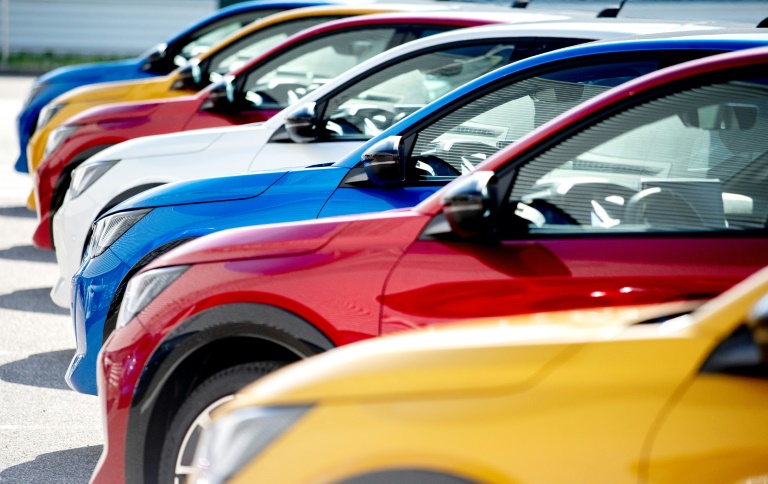
I want to click on mirrors, so click(x=760, y=320), click(x=475, y=212), click(x=386, y=157), click(x=303, y=123), click(x=239, y=92), click(x=200, y=71), click(x=164, y=53).